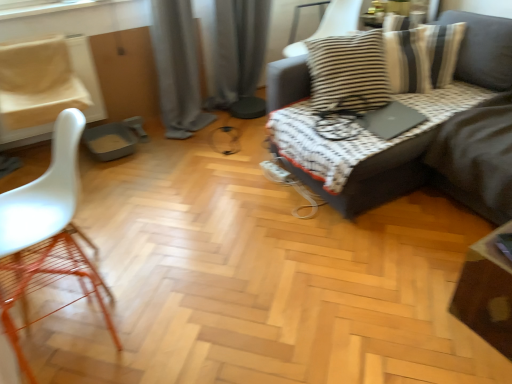
Question: Would you say striped fabric cushion at upper right, placed as the 3th chair when sorted from left to right, contains gray fabric curtain at center, the first curtain when ordered from left to right?

Choices:
 (A) yes
 (B) no

Answer: (B)

Question: Considering the relative positions of striped fabric cushion at upper right, which is the first chair from right to left, and gray fabric curtain at center, the first curtain when ordered from left to right, in the image provided, is striped fabric cushion at upper right, which is the first chair from right to left, to the right of gray fabric curtain at center, the first curtain when ordered from left to right, from the viewer's perspective?

Choices:
 (A) yes
 (B) no

Answer: (A)

Question: Considering the relative sizes of striped fabric cushion at upper right, the first chair viewed from the top, and gray fabric curtain at center, which is the second curtain from right to left, in the image provided, is striped fabric cushion at upper right, the first chair viewed from the top, shorter than gray fabric curtain at center, which is the second curtain from right to left,?

Choices:
 (A) yes
 (B) no

Answer: (A)

Question: Is striped fabric cushion at upper right, the 3th chair when ordered from bottom to top, smaller than gray fabric curtain at center, which is the second curtain from right to left?

Choices:
 (A) no
 (B) yes

Answer: (B)

Question: Is the depth of striped fabric cushion at upper right, the first chair viewed from the top, less than that of gray fabric curtain at center, the first curtain when ordered from left to right?

Choices:
 (A) no
 (B) yes

Answer: (A)

Question: From the image's perspective, is striped fabric cushion at upper right, the first chair viewed from the top, located above gray fabric curtain at center, the first curtain when ordered from left to right?

Choices:
 (A) no
 (B) yes

Answer: (B)

Question: Could you tell me if black matte laptop at upper right is facing white plastic chair at left, the 3th chair positioned from the right?

Choices:
 (A) yes
 (B) no

Answer: (B)

Question: Considering the relative positions of black matte laptop at upper right and white plastic chair at left, positioned as the 2th chair in back-to-front order, in the image provided, is black matte laptop at upper right to the left of white plastic chair at left, positioned as the 2th chair in back-to-front order, from the viewer's perspective?

Choices:
 (A) yes
 (B) no

Answer: (B)

Question: From the image's perspective, is black matte laptop at upper right on white plastic chair at left, which is counted as the second chair, starting from the bottom?

Choices:
 (A) yes
 (B) no

Answer: (B)

Question: From the image's perspective, is black matte laptop at upper right located beneath white plastic chair at left, positioned as the first chair in left-to-right order?

Choices:
 (A) no
 (B) yes

Answer: (B)

Question: Does black matte laptop at upper right come in front of white plastic chair at left, which is counted as the second chair, starting from the bottom?

Choices:
 (A) yes
 (B) no

Answer: (A)

Question: Can you confirm if black matte laptop at upper right is thinner than white plastic chair at left, the 3th chair positioned from the right?

Choices:
 (A) yes
 (B) no

Answer: (A)

Question: Is white plastic chair at left, the 3th chair positioned from the right, further to the viewer compared to white matte chair at left, marked as the 2th chair in a right-to-left arrangement?

Choices:
 (A) no
 (B) yes

Answer: (B)